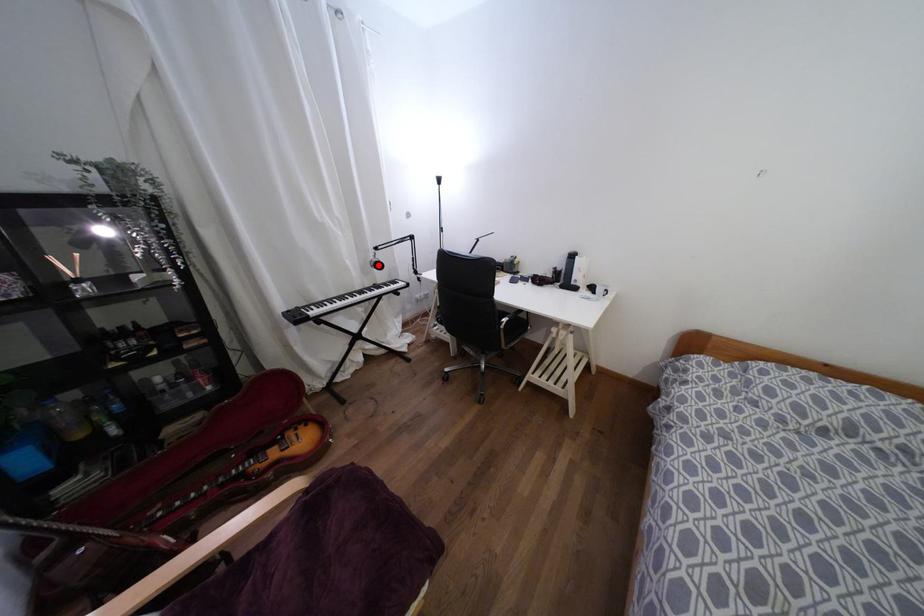
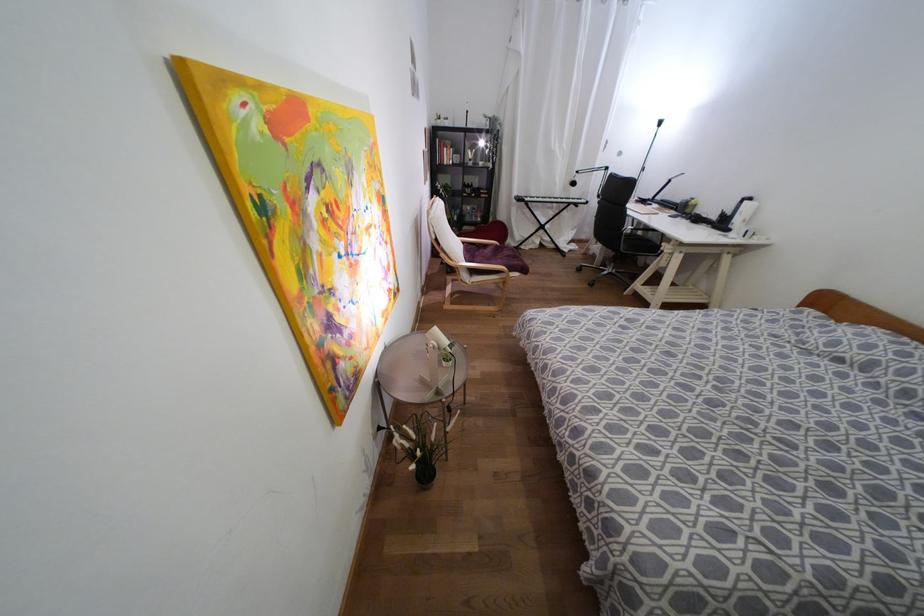
Where in the second image is the point corresponding to the highlighted location from the first image?

(573, 183)